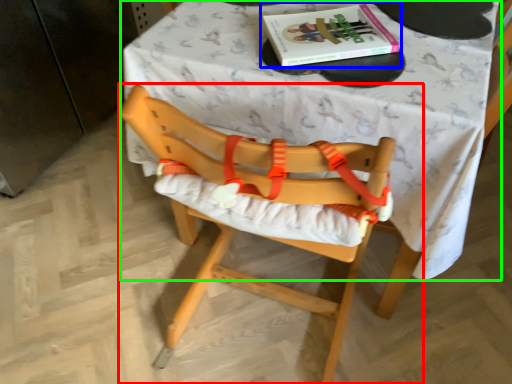
Question: Which is farther away from chair (highlighted by a red box)? book (highlighted by a blue box) or table (highlighted by a green box)?

Choices:
 (A) book
 (B) table

Answer: (A)